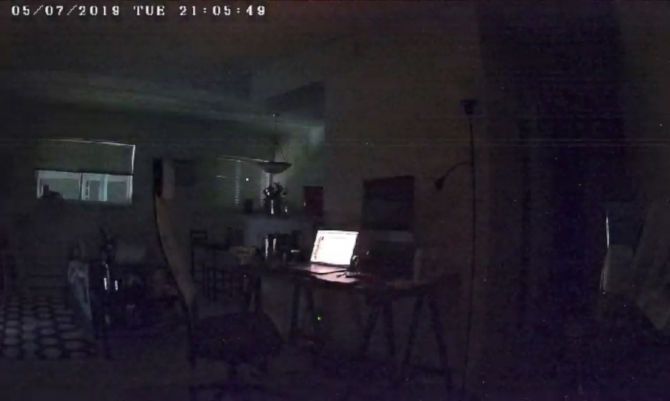
Find the location of a particular element. This screenshot has height=401, width=670. ceiling is located at coordinates (151, 48).